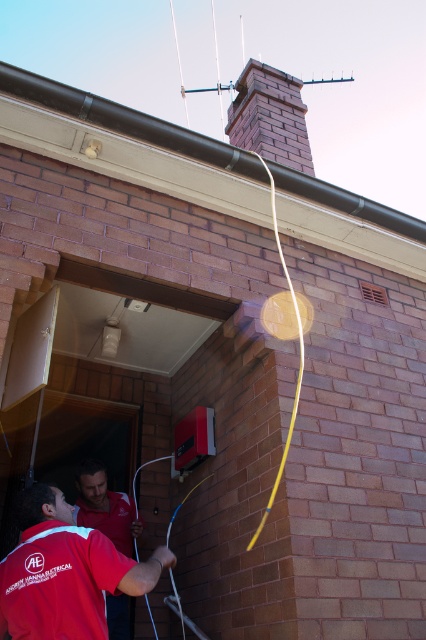
Who is lower down, red fabric shirt at lower left or red brick chimney at center?

red fabric shirt at lower left

Who is more distant from viewer, (149, 561) or (259, 67)?

Point (259, 67)

I want to click on red fabric shirt at lower left, so click(x=65, y=572).

Does red brick chimney at center have a lesser height compared to red matte shirt at lower left?

In fact, red brick chimney at center may be taller than red matte shirt at lower left.

Is red brick chimney at center below red matte shirt at lower left?

Actually, red brick chimney at center is above red matte shirt at lower left.

Which is behind, point (259, 83) or point (91, 464)?

Point (259, 83)

This screenshot has width=426, height=640. Identify the location of red brick chimney at center. (270, 116).

Can you confirm if red fabric shirt at lower left is positioned below red matte shirt at lower left?

No.

Does red fabric shirt at lower left have a greater width compared to red matte shirt at lower left?

Yes, red fabric shirt at lower left is wider than red matte shirt at lower left.

What are the coordinates of `red fabric shirt at lower left` in the screenshot? It's located at (65, 572).